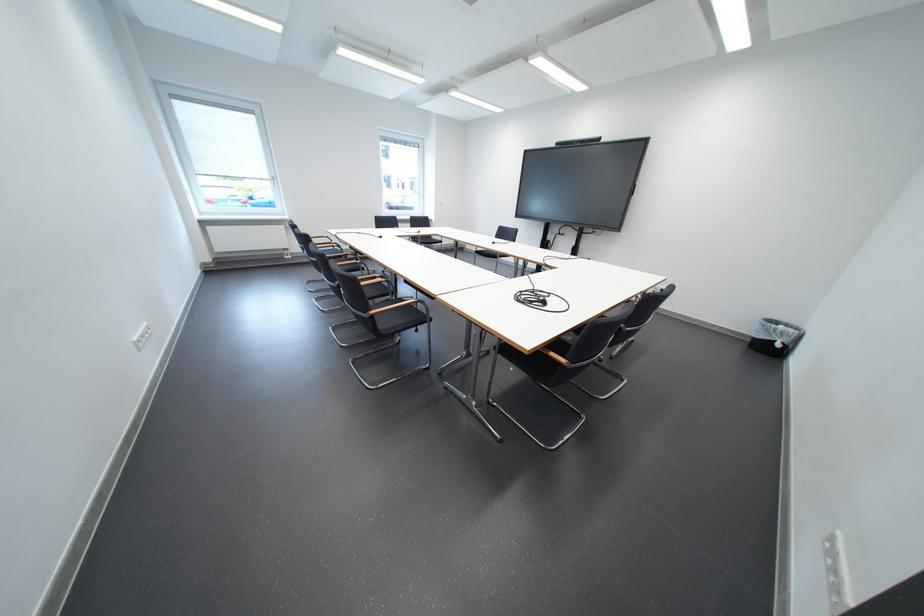
Where is `black chair seat`? black chair seat is located at coordinates (386, 313).